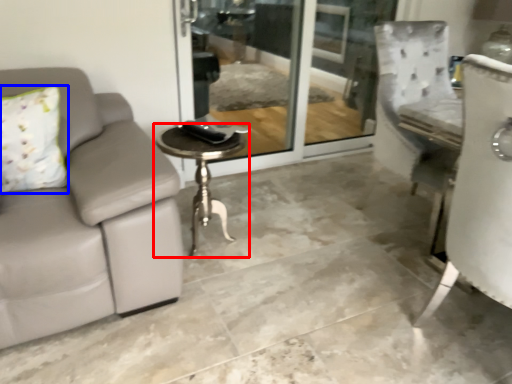
Question: Which of the following is the farthest to the observer, table (highlighted by a red box) or pillow (highlighted by a blue box)?

Choices:
 (A) table
 (B) pillow

Answer: (A)